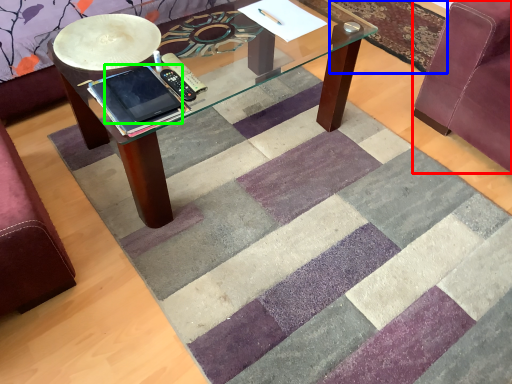
Question: Which object is the farthest from swivel chair (highlighted by a red box)? Choose among these: mat (highlighted by a blue box) or ipad (highlighted by a green box).

Choices:
 (A) mat
 (B) ipad

Answer: (B)